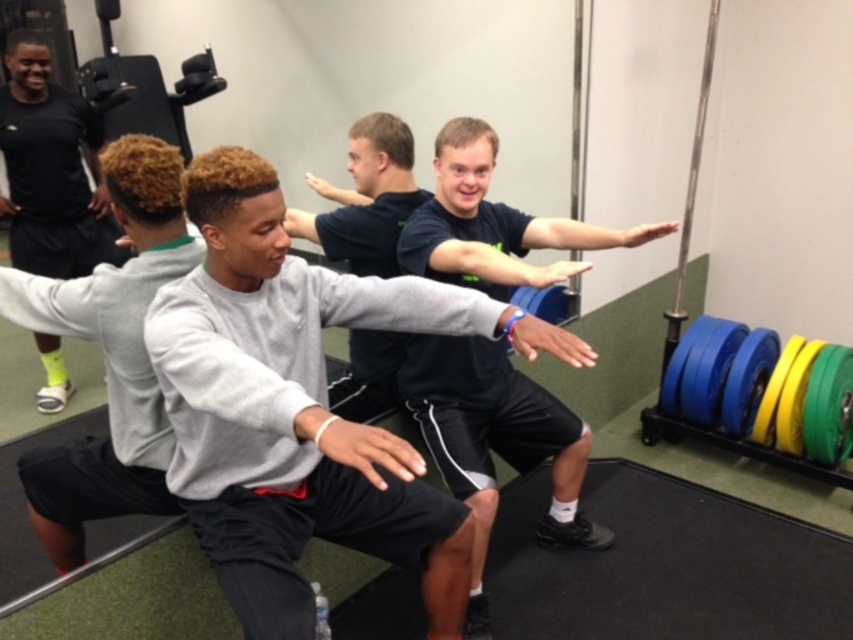
Does gray matte sweatshirt at center appear on the right side of gray sweatshirt at center?

Yes, gray matte sweatshirt at center is to the right of gray sweatshirt at center.

Is gray matte sweatshirt at center positioned at the back of gray sweatshirt at center?

No, it is in front of gray sweatshirt at center.

The height and width of the screenshot is (640, 853). I want to click on gray matte sweatshirt at center, so click(300, 406).

Who is positioned more to the right, gray sweatshirt at center or black matte shirt at upper left?

gray sweatshirt at center is more to the right.

Can you confirm if gray sweatshirt at center is smaller than black matte shirt at upper left?

Yes, gray sweatshirt at center is smaller than black matte shirt at upper left.

Between point (19, 464) and point (22, 218), which one is positioned in front?

Point (19, 464)

The image size is (853, 640). Identify the location of gray sweatshirt at center. (109, 355).

Does dark blue shirt at center have a lesser width compared to gray sweatshirt at center?

No, dark blue shirt at center is not thinner than gray sweatshirt at center.

Is dark blue shirt at center positioned behind gray sweatshirt at center?

That is False.

Is point (486, 636) in front of point (138, 228)?

No.

Where is `dark blue shirt at center`? Image resolution: width=853 pixels, height=640 pixels. dark blue shirt at center is located at coordinates (495, 442).